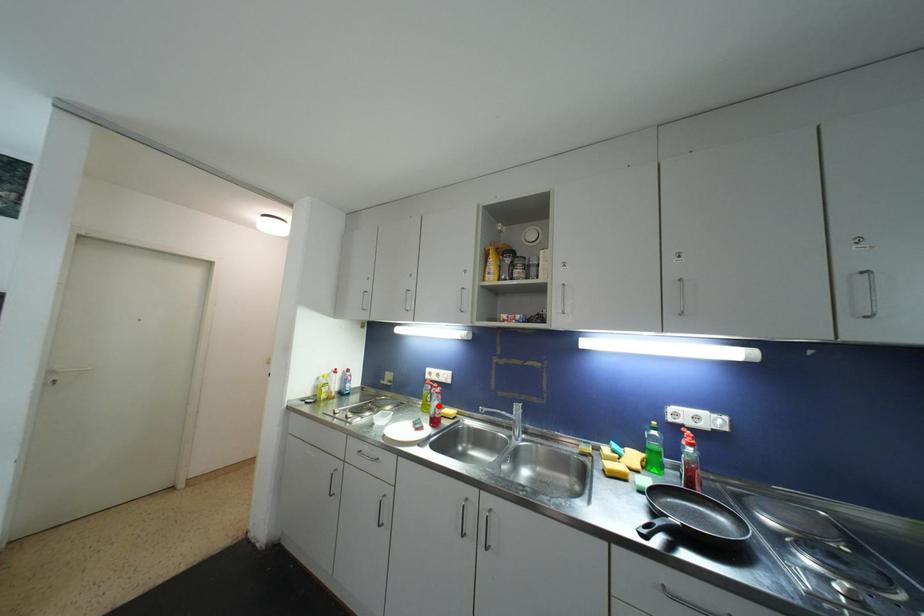
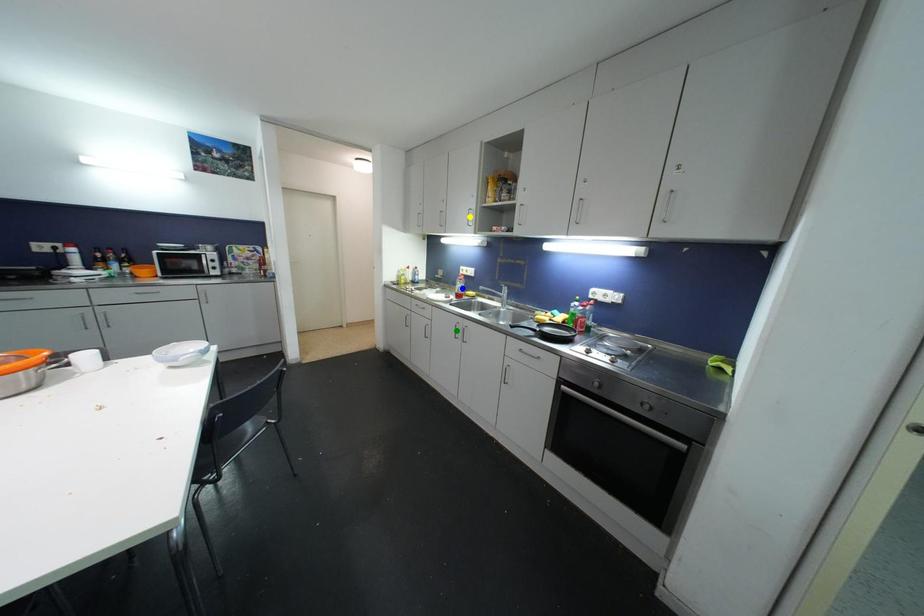
Question: I am providing you with two images of the same scene from different viewpoints. A red point is marked on the first image. You are given multiple points on the second image. In image 2, which mark is for the same physical point as the one in image 1?

Choices:
 (A) green point
 (B) yellow point
 (C) blue point

Answer: (C)